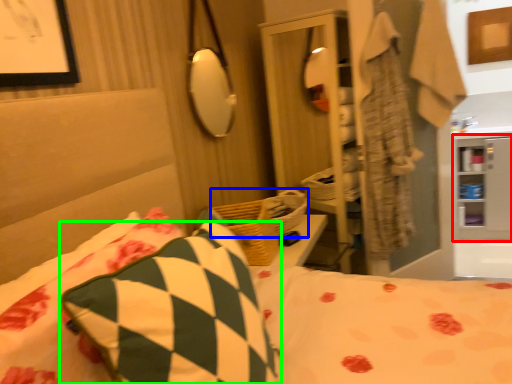
Question: Which object is positioned farthest from cabinet (highlighted by a red box)? Select from basket (highlighted by a blue box) and pillow (highlighted by a green box).

Choices:
 (A) basket
 (B) pillow

Answer: (B)